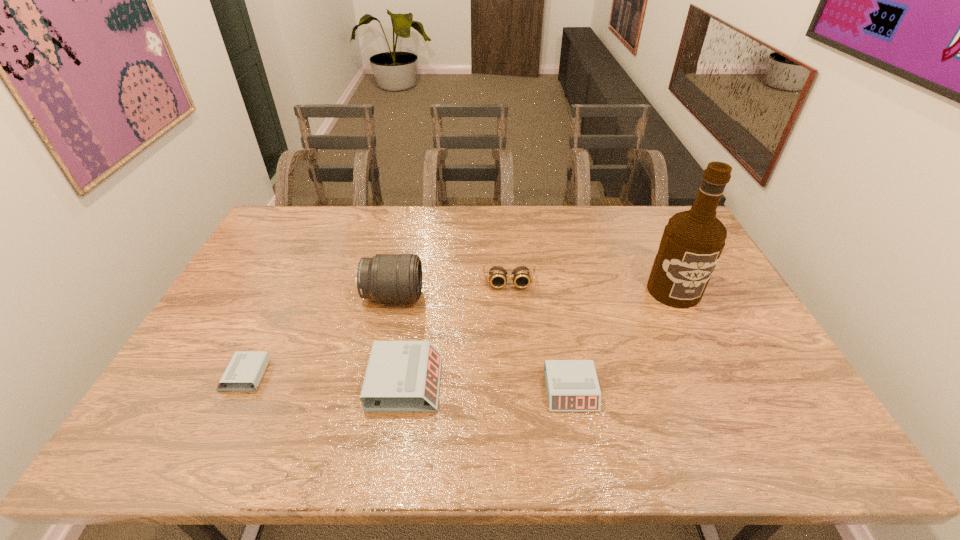
The height and width of the screenshot is (540, 960). Find the location of `vacant region at the left edge of the desktop`. vacant region at the left edge of the desktop is located at coordinates (284, 267).

You are a GUI agent. You are given a task and a screenshot of the screen. Output one action in this format:
    pyautogui.click(x=<x>, y=<y>)
    Task: Click on the vacant space at the right edge of the desktop
    Image resolution: width=960 pixels, height=540 pixels.
    Given the screenshot: What is the action you would take?
    pyautogui.click(x=733, y=296)

At what (x,y) coordinates should I click in order to perform the action: click on vacant space at the far left corner. Please return your answer as a coordinate pair (x, y). This screenshot has height=540, width=960. Looking at the image, I should click on (283, 216).

Identify the location of free space between the shortest alarm clock and the telephoto lens. This screenshot has height=540, width=960. (319, 335).

The height and width of the screenshot is (540, 960). Find the location of `free space between the rightmost alarm clock and the goggles`. free space between the rightmost alarm clock and the goggles is located at coordinates click(540, 336).

Where is `free space that is in between the rightmost object and the second tallest alarm clock`? The image size is (960, 540). free space that is in between the rightmost object and the second tallest alarm clock is located at coordinates (622, 340).

You are a GUI agent. You are given a task and a screenshot of the screen. Output one action in this format:
    pyautogui.click(x=<x>, y=<y>)
    Task: Click on the vacant area between the shortest object and the alcohol
    Image resolution: width=960 pixels, height=540 pixels.
    Given the screenshot: What is the action you would take?
    pyautogui.click(x=459, y=333)

Find the location of `free area in between the tallest object and the tallest alarm clock`. free area in between the tallest object and the tallest alarm clock is located at coordinates (540, 336).

At what (x,y) coordinates should I click in order to perform the action: click on empty space between the tallest alarm clock and the tallest object. Please return your answer as a coordinate pair (x, y). The height and width of the screenshot is (540, 960). Looking at the image, I should click on (540, 336).

Identify the location of vacant space that's between the leftmost alarm clock and the goggles. The height and width of the screenshot is (540, 960). (377, 329).